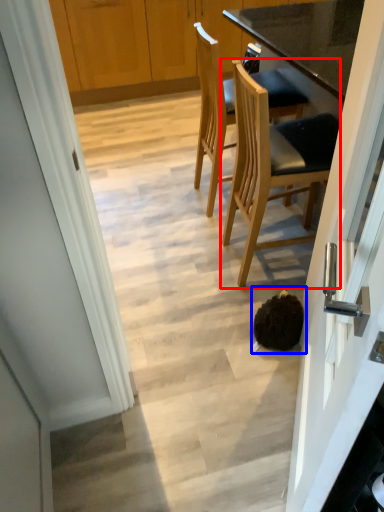
Question: Among these objects, which one is nearest to the camera, chair (highlighted by a red box) or head (highlighted by a blue box)?

Choices:
 (A) chair
 (B) head

Answer: (A)